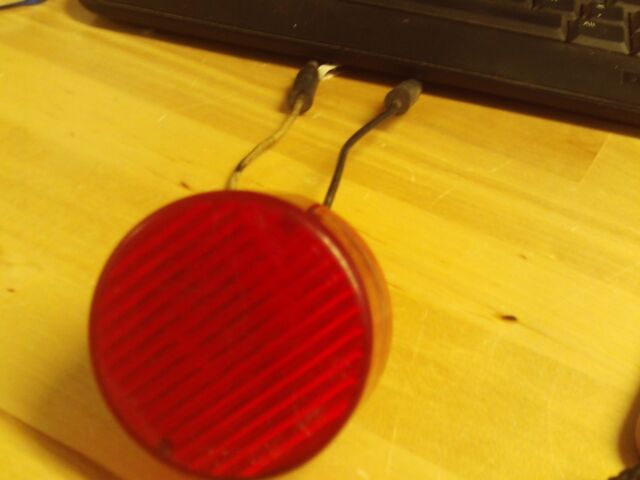
Locate an element on the screen. scuffs in wood is located at coordinates (500, 319), (182, 179).